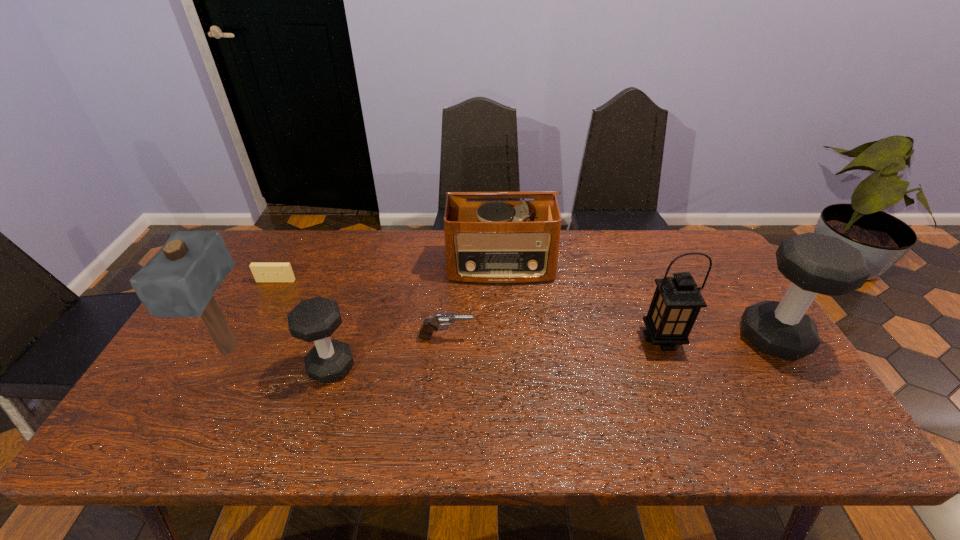
Identify the location of object that is at the right edge. The image size is (960, 540). (814, 263).

Find the location of a particular element. This screenshot has height=540, width=960. free space at the far edge of the desktop is located at coordinates (565, 261).

Locate an element on the screen. Image resolution: width=960 pixels, height=540 pixels. vacant space at the left edge of the desktop is located at coordinates (261, 294).

Locate an element on the screen. This screenshot has height=540, width=960. blank area at the far left corner is located at coordinates tap(254, 256).

Locate an element on the screen. The width and height of the screenshot is (960, 540). free region at the near left corner is located at coordinates (210, 401).

Find the location of a particular element. Image resolution: width=960 pixels, height=540 pixels. vacant space at the far right corner of the desktop is located at coordinates (714, 271).

The height and width of the screenshot is (540, 960). I want to click on unoccupied position between the radio receiver and the videotape, so click(x=388, y=274).

The image size is (960, 540). What are the coordinates of `free space between the mallet and the radio receiver` in the screenshot? It's located at (365, 308).

Find the location of a particular element. free point between the rightmost object and the shortest object is located at coordinates (524, 310).

In order to click on free point between the second shortest object and the shortest object in this screenshot , I will do `click(361, 309)`.